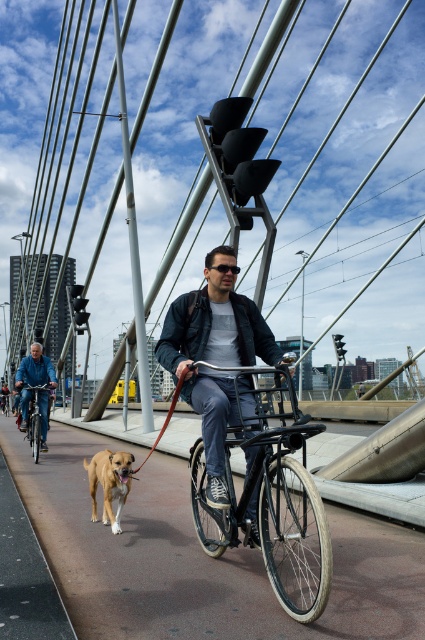
You are a pedestrian on the bridge and see the matte black jacket at center and the shiny silver bicycle at left. Which object is covering the other?

The matte black jacket at center is positioned over the shiny silver bicycle at left, so it is covering the shiny silver bicycle at left.

You are standing on the bridge and want to take a photo of the shiny silver bicycle at left. The camera you have can focus on objects up to 30 feet away. Will the bicycle be in focus?

The shiny silver bicycle at left is 30.55 feet away from the camera, which is beyond the camera focus range of 30 feet. Therefore, the bicycle will not be in focus.